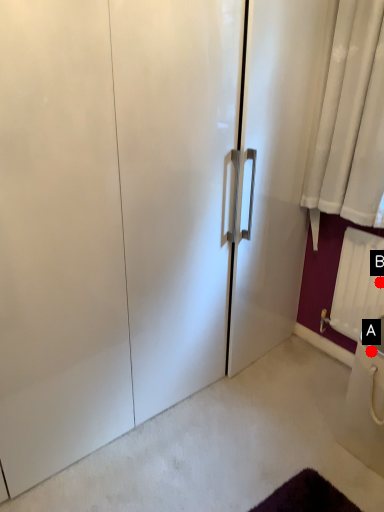
Question: Two points are circled on the image, labeled by A and B beside each circle. Which point is closer to the camera taking this photo?

Choices:
 (A) A is closer
 (B) B is closer

Answer: (A)